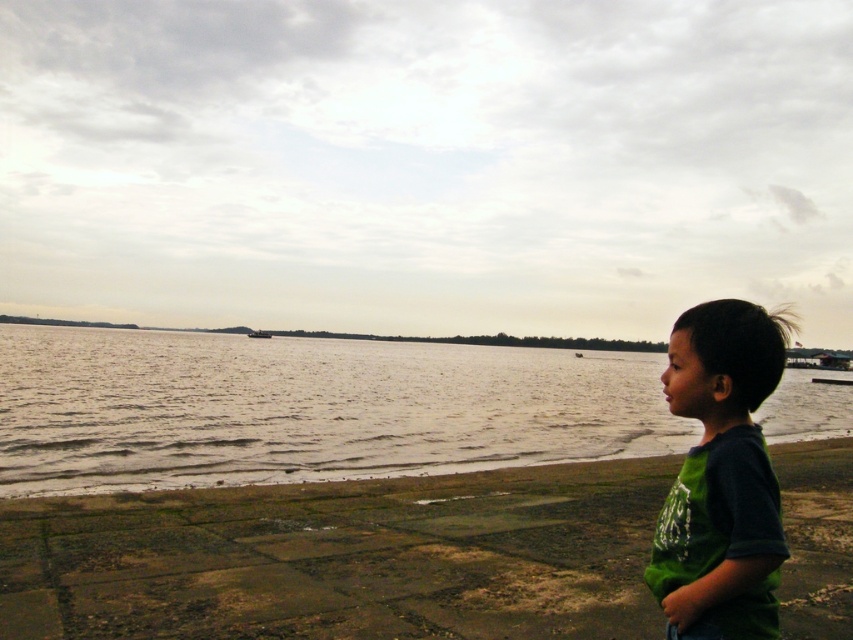
Question: Estimate the real-world distances between objects in this image. Which object is farther from the smooth concrete beach at lower right?

Choices:
 (A) green cotton shirt at lower right
 (B) dark gray metallic boat at center
 (C) grayish water at lower left

Answer: (B)

Question: Is smooth concrete beach at lower right below grayish water at lower left?

Choices:
 (A) no
 (B) yes

Answer: (B)

Question: Can you confirm if smooth concrete beach at lower right is thinner than green cotton shirt at lower right?

Choices:
 (A) no
 (B) yes

Answer: (A)

Question: Which of the following is the closest to the observer?

Choices:
 (A) grayish water at lower left
 (B) dark gray metallic boat at center
 (C) smooth concrete beach at lower right
 (D) green cotton shirt at lower right

Answer: (D)

Question: Which point appears farthest from the camera in this image?

Choices:
 (A) (21, 552)
 (B) (701, 570)

Answer: (A)

Question: Does green cotton shirt at lower right appear on the left side of dark gray metallic boat at center?

Choices:
 (A) no
 (B) yes

Answer: (A)